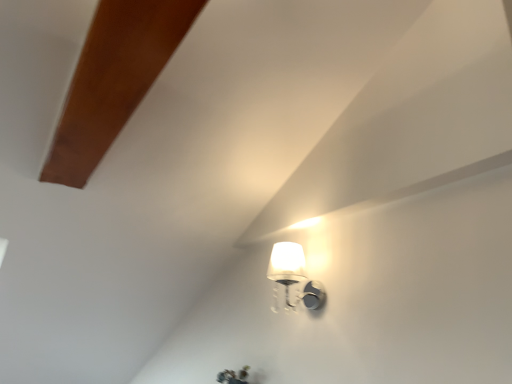
What do you see at coordinates (293, 276) in the screenshot? I see `white glossy wall sconce at upper right` at bounding box center [293, 276].

The width and height of the screenshot is (512, 384). Identify the location of white glossy wall sconce at upper right. (293, 276).

Image resolution: width=512 pixels, height=384 pixels. Find the location of `white glossy wall sconce at upper right`. white glossy wall sconce at upper right is located at coordinates (293, 276).